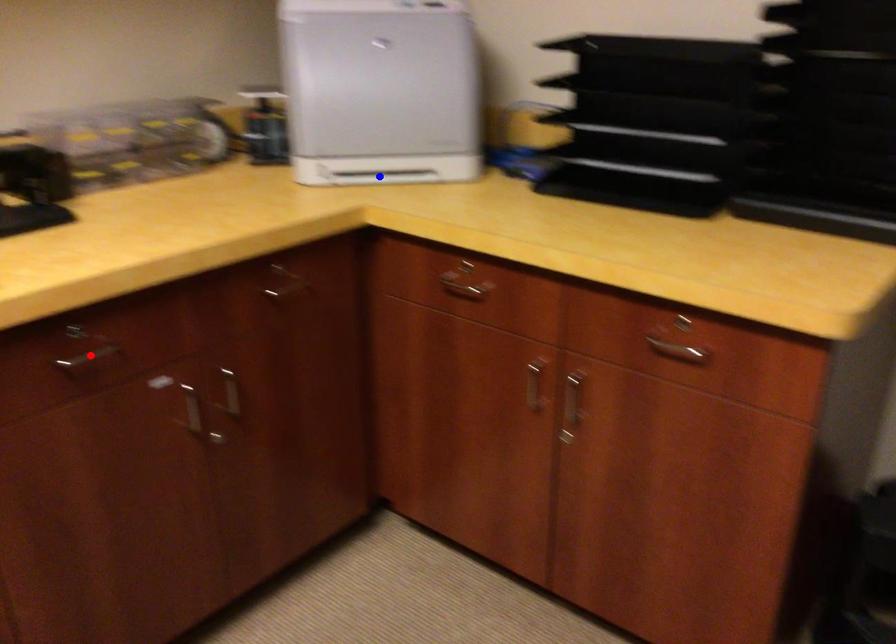
Question: Two points are marked on the image. Which point is closer to the camera?

Choices:
 (A) Blue point is closer.
 (B) Red point is closer.

Answer: (B)